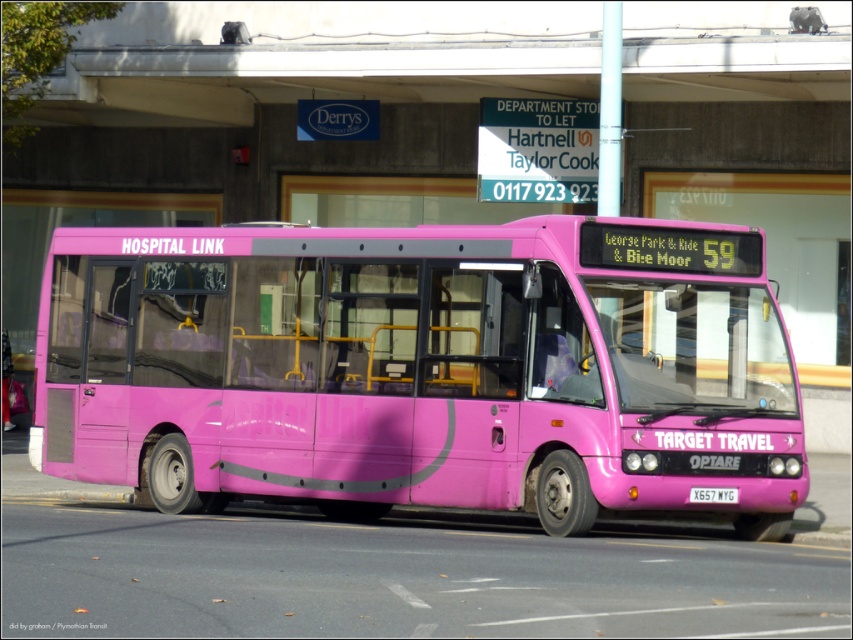
Question: Does matte pink bus at center have a greater width compared to white plastic license plate at center?

Choices:
 (A) yes
 (B) no

Answer: (A)

Question: In this image, where is matte pink bus at center located relative to white plastic license plate at center?

Choices:
 (A) right
 (B) left

Answer: (B)

Question: Which point appears closest to the camera in this image?

Choices:
 (A) (328, 371)
 (B) (698, 496)

Answer: (B)

Question: Which point appears farthest from the camera in this image?

Choices:
 (A) (604, 250)
 (B) (709, 492)

Answer: (A)

Question: Can you confirm if matte pink bus at center is wider than white plastic license plate at center?

Choices:
 (A) no
 (B) yes

Answer: (B)

Question: Which point is closer to the camera?

Choices:
 (A) (724, 294)
 (B) (730, 486)

Answer: (B)